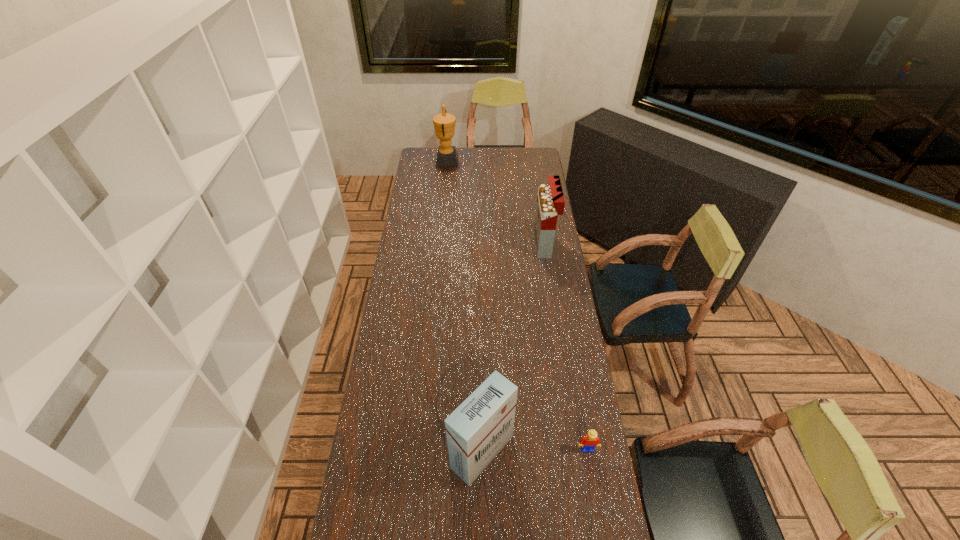
Locate an element on the screen. The width and height of the screenshot is (960, 540). the leftmost object is located at coordinates (444, 123).

Locate an element on the screen. the farthest object is located at coordinates (444, 123).

This screenshot has height=540, width=960. What are the coordinates of `the second farthest object` in the screenshot? It's located at (550, 200).

Where is `the farther cigarette case`? the farther cigarette case is located at coordinates (550, 200).

At what (x,y) coordinates should I click in order to perform the action: click on the nearer cigarette case. Please return your answer as a coordinate pair (x, y). Looking at the image, I should click on (476, 431).

What are the coordinates of `the left cigarette case` in the screenshot? It's located at (476, 431).

Identify the location of Lego. This screenshot has width=960, height=540. (587, 443).

Where is `vacant position located at the front of the leftmost object with handles`? vacant position located at the front of the leftmost object with handles is located at coordinates (521, 161).

Find the location of a particular element. The image size is (960, 540). vacant space situated with the lid open on the farther cigarette case is located at coordinates (475, 244).

The image size is (960, 540). In order to click on free location located with the lid open on the farther cigarette case in this screenshot , I will do `click(511, 244)`.